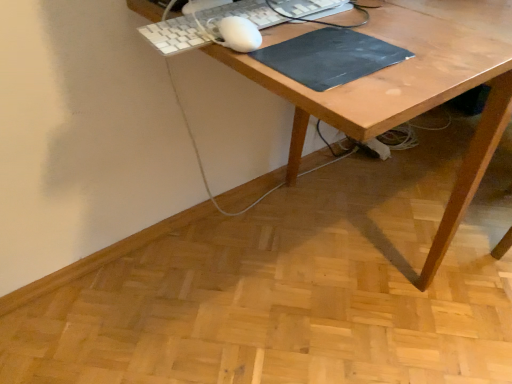
Question: Considering the positions of point (449, 1) and point (315, 13), is point (449, 1) closer or farther from the camera than point (315, 13)?

Choices:
 (A) farther
 (B) closer

Answer: (A)

Question: Considering the relative positions of wooden desk at center and white plastic keyboard at upper center in the image provided, is wooden desk at center to the left or to the right of white plastic keyboard at upper center?

Choices:
 (A) right
 (B) left

Answer: (A)

Question: Which of these objects is positioned closest to the black matte mousepad at center?

Choices:
 (A) white plastic keyboard at upper center
 (B) wooden desk at center

Answer: (B)

Question: Which of these objects is positioned closest to the black matte mousepad at center?

Choices:
 (A) white plastic keyboard at upper center
 (B) wooden desk at center

Answer: (B)